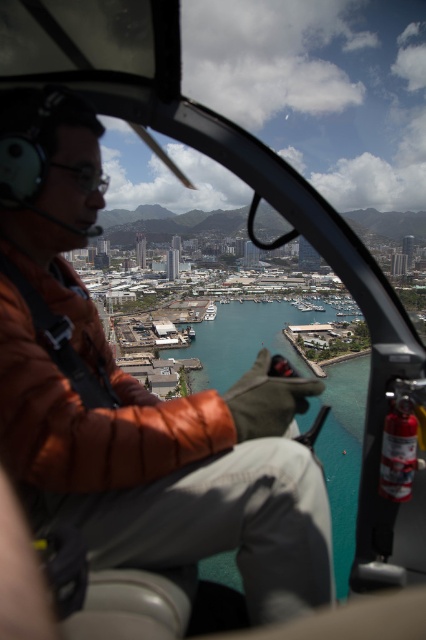
Question: Which of the following is the farthest from the observer?

Choices:
 (A) teal glossy water at center
 (B) brown leather jacket at center

Answer: (A)

Question: Does brown leather jacket at center have a smaller size compared to teal glossy water at center?

Choices:
 (A) no
 (B) yes

Answer: (A)

Question: Is brown leather jacket at center further to the viewer compared to teal glossy water at center?

Choices:
 (A) yes
 (B) no

Answer: (B)

Question: Is brown leather jacket at center thinner than teal glossy water at center?

Choices:
 (A) yes
 (B) no

Answer: (B)